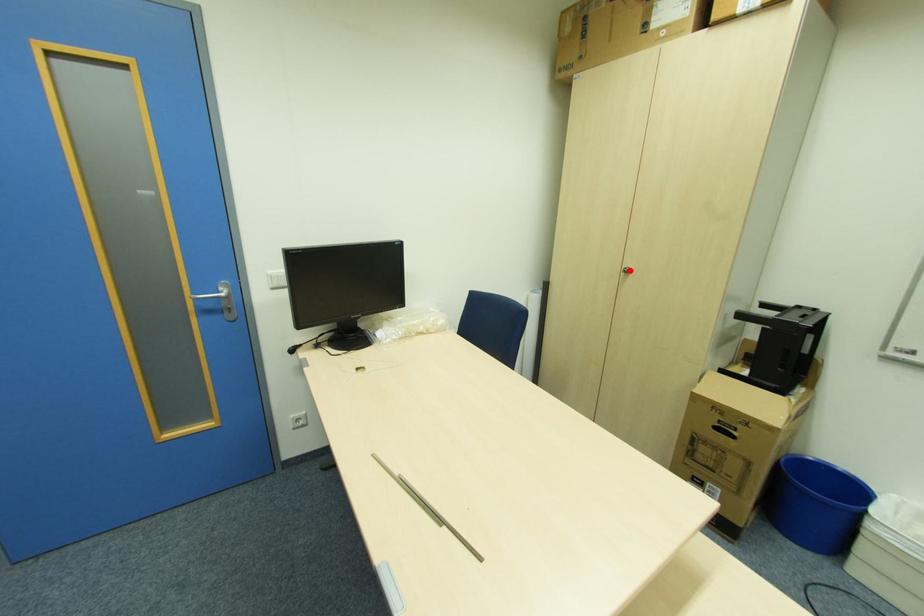
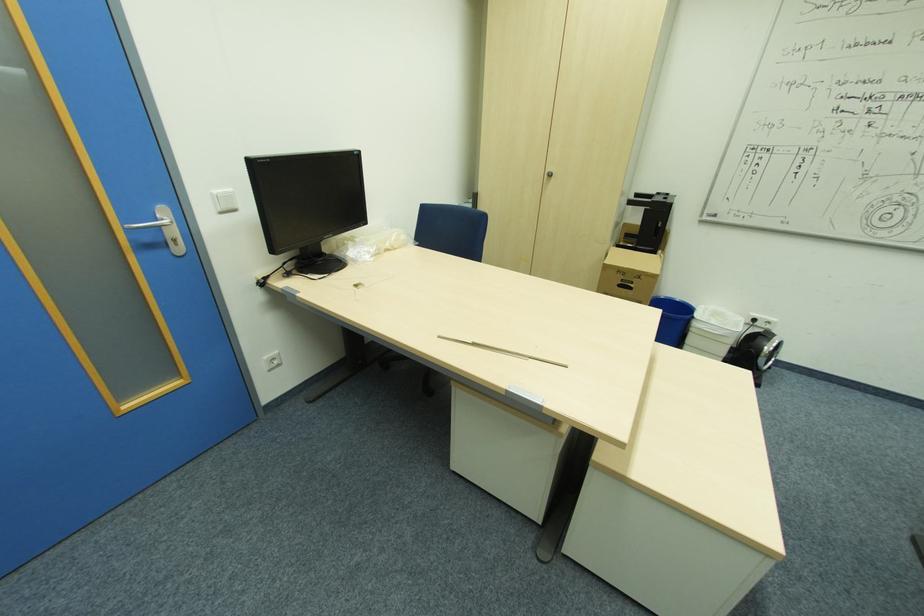
Where in the second image is the point corresponding to the highlighted location from the first image?

(553, 175)